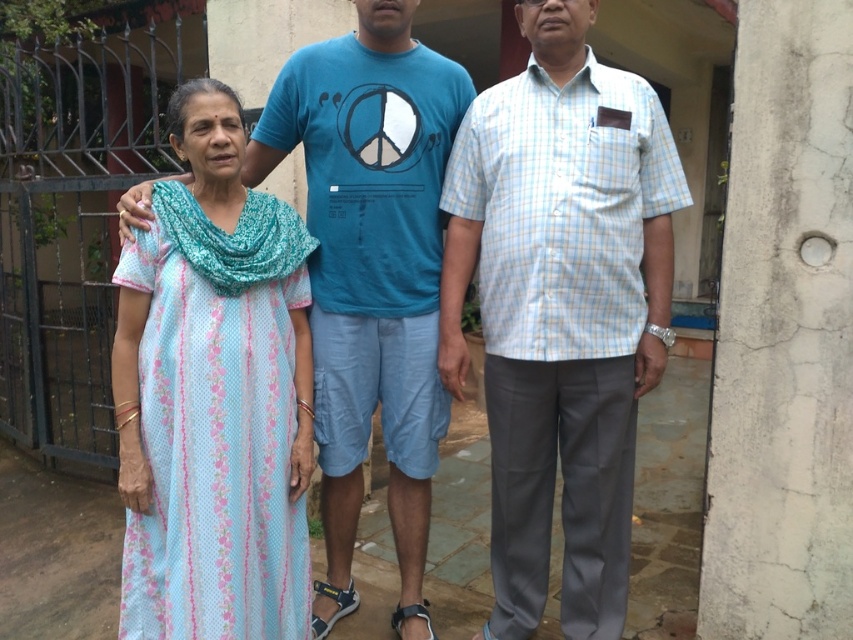
Question: Can you confirm if light blue floral dress at left is smaller than light blue floral dress at center?

Choices:
 (A) no
 (B) yes

Answer: (B)

Question: Which object is the farthest from the light blue floral dress at center?

Choices:
 (A) light blue floral dress at left
 (B) light blue checkered shirt at center

Answer: (A)

Question: Is light blue checkered shirt at center to the right of light blue floral dress at center from the viewer's perspective?

Choices:
 (A) yes
 (B) no

Answer: (A)

Question: Which object appears closest to the camera in this image?

Choices:
 (A) light blue floral dress at left
 (B) light blue floral dress at center

Answer: (A)

Question: Does light blue checkered shirt at center have a smaller size compared to light blue floral dress at left?

Choices:
 (A) no
 (B) yes

Answer: (A)

Question: Which of these objects is positioned farthest from the light blue floral dress at center?

Choices:
 (A) light blue floral dress at left
 (B) light blue checkered shirt at center

Answer: (A)